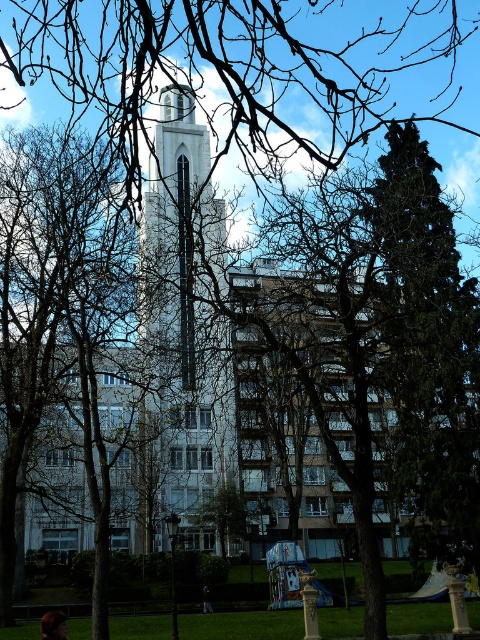
Question: Is green leafy tree at right in front of white stone tower at center?

Choices:
 (A) no
 (B) yes

Answer: (A)

Question: Does green leafy tree at right appear on the left side of white stone tower at center?

Choices:
 (A) no
 (B) yes

Answer: (A)

Question: Which point is closer to the camera?

Choices:
 (A) (475, 352)
 (B) (146, 296)

Answer: (A)

Question: Which of the following is the farthest from the observer?

Choices:
 (A) pyautogui.click(x=192, y=390)
 (B) pyautogui.click(x=411, y=346)

Answer: (A)

Question: Can you confirm if green leafy tree at right is thinner than white stone tower at center?

Choices:
 (A) yes
 (B) no

Answer: (B)